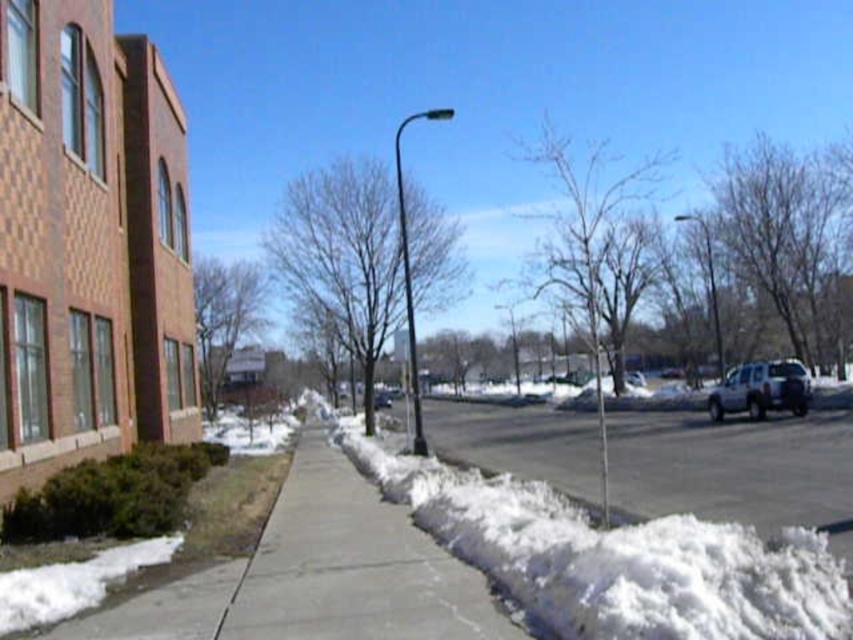
You are a delivery person trying to park your white matte truck at right near the white fluffy snow at lower right. Can you safely park the truck so that it won not block the sidewalk?

The white fluffy snow at lower right is shorter than the white matte truck at right, so the truck can be parked near the snow without blocking the sidewalk as long as it stays on the street.

You are standing on the sidewalk in the winter scene. You see a point marked at coordinates (616, 557). Where is this point located in relation to the white fluffy snow at lower right?

The point (616, 557) is located on the white fluffy snow at lower right.